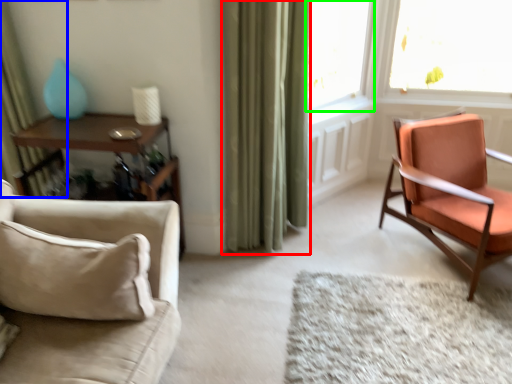
Question: Which object is the closest to the curtain (highlighted by a red box)? Choose among these: curtain (highlighted by a blue box) or window (highlighted by a green box).

Choices:
 (A) curtain
 (B) window

Answer: (B)